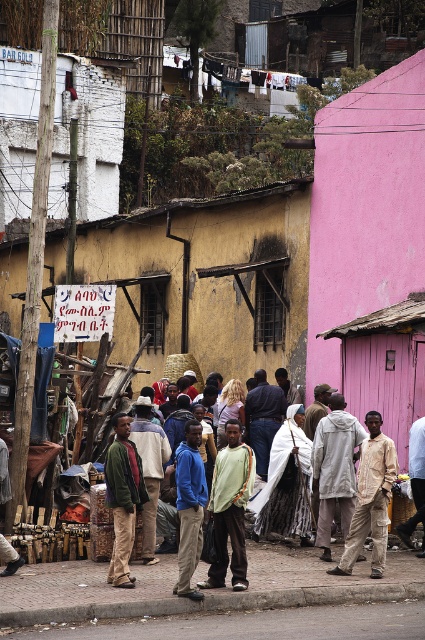
Can you confirm if light green fabric shirt at center is positioned to the left of blue matte jacket at center?

Incorrect, light green fabric shirt at center is not on the left side of blue matte jacket at center.

Is the position of light green fabric shirt at center less distant than that of blue matte jacket at center?

That is False.

The height and width of the screenshot is (640, 425). Describe the element at coordinates (231, 508) in the screenshot. I see `light green fabric shirt at center` at that location.

The image size is (425, 640). In order to click on light green fabric shirt at center in this screenshot , I will do `click(231, 508)`.

Does pink matte hut at center-right appear on the left side of light gray hoodie at center?

Incorrect, pink matte hut at center-right is not on the left side of light gray hoodie at center.

Is pink matte hut at center-right above light gray hoodie at center?

Indeed, pink matte hut at center-right is positioned over light gray hoodie at center.

Is point (405, 109) farther from viewer compared to point (326, 540)?

Yes, point (405, 109) is behind point (326, 540).

Find the location of a particular element. pink matte hut at center-right is located at coordinates (371, 248).

Can you confirm if light brown striped shirt at center is positioned to the left of light brown leather jacket at center?

Yes, light brown striped shirt at center is to the left of light brown leather jacket at center.

Which is in front, point (343, 554) or point (411, 429)?

Point (343, 554) is more forward.

The image size is (425, 640). What are the coordinates of `light brown striped shirt at center` in the screenshot? It's located at (371, 499).